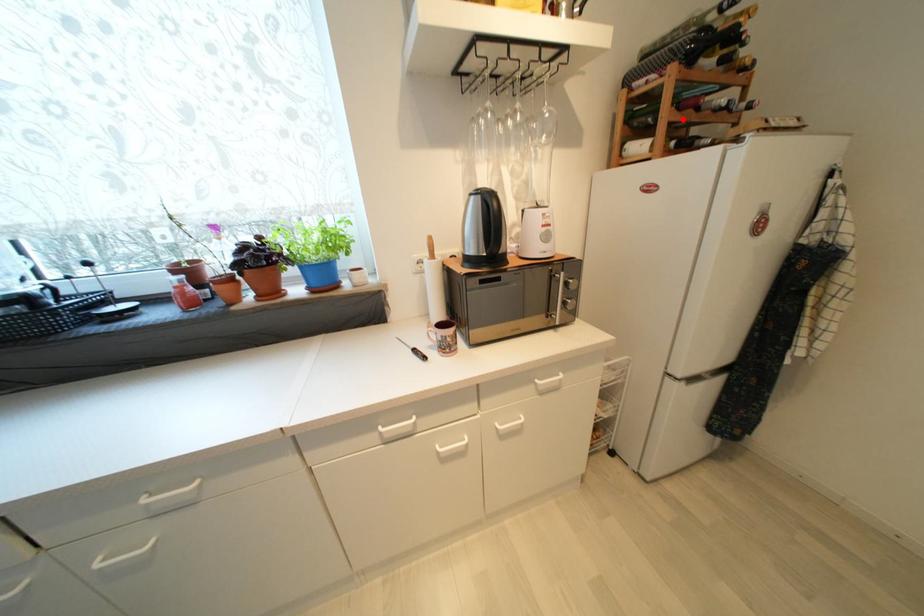
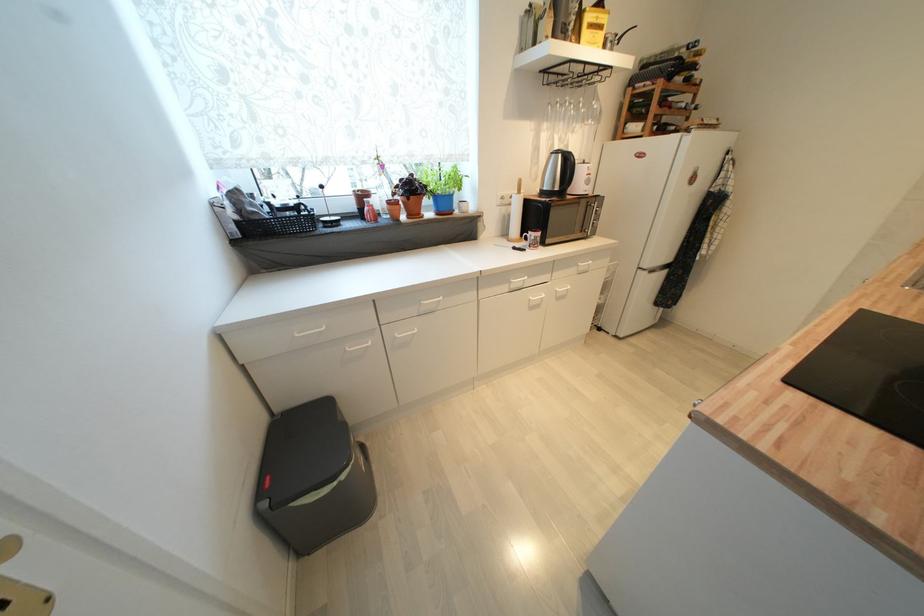
The point at the highlighted location is marked in the first image. Where is the corresponding point in the second image?

(664, 114)